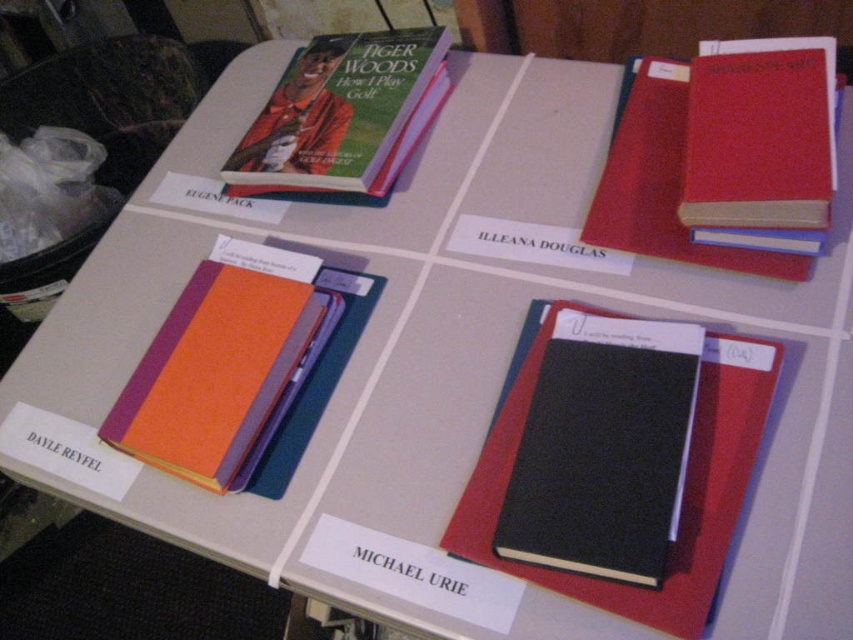
Question: Which object is the closest to the hardcover book at upper left?

Choices:
 (A) black matte notebook at center-right
 (B) matte red book at upper right
 (C) red matte book at upper right
 (D) orange fabric binder at lower left

Answer: (D)

Question: Can you confirm if black matte notebook at center-right is wider than orange fabric binder at lower left?

Choices:
 (A) no
 (B) yes

Answer: (A)

Question: Among these objects, which one is nearest to the camera?

Choices:
 (A) red matte book at upper right
 (B) orange fabric binder at lower left

Answer: (B)

Question: Does orange fabric binder at lower left appear on the right side of red matte book at upper right?

Choices:
 (A) yes
 (B) no

Answer: (B)

Question: Which object is positioned farthest from the hardcover book at upper left?

Choices:
 (A) matte red book at upper right
 (B) orange fabric binder at lower left
 (C) red matte book at upper right

Answer: (A)

Question: From the image, what is the correct spatial relationship of hardcover book at upper left in relation to red matte book at upper right?

Choices:
 (A) right
 (B) left

Answer: (B)